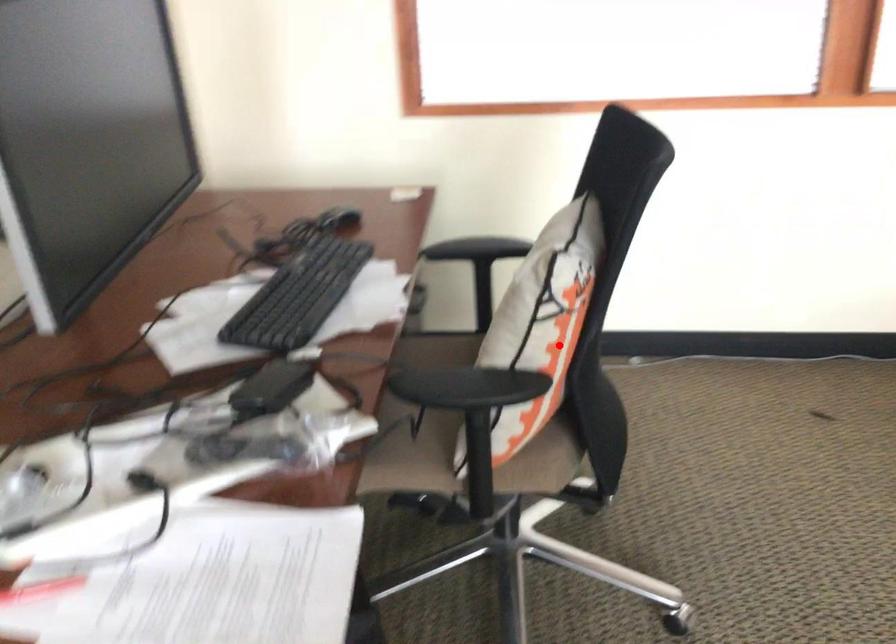
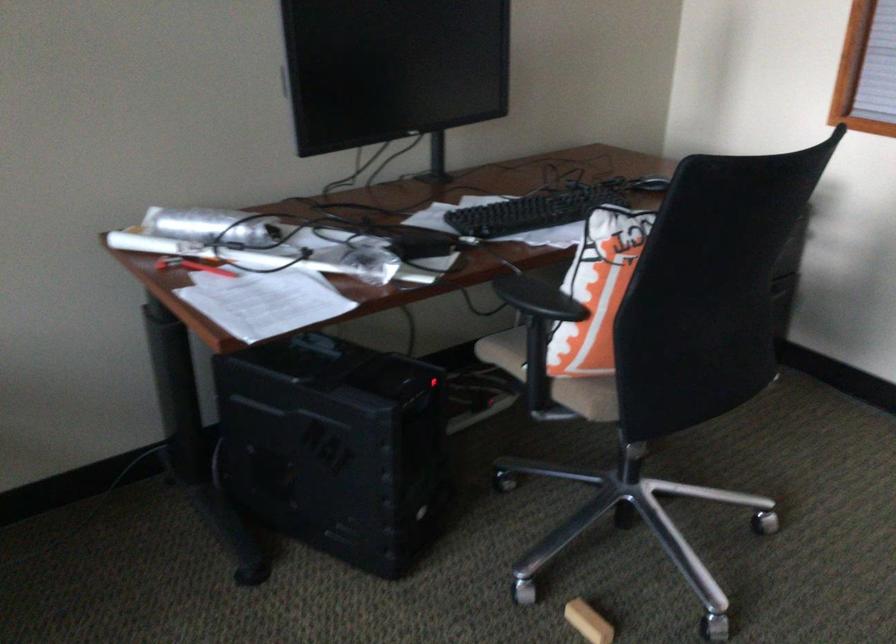
Locate, in the second image, the point that corresponds to the highlighted location in the first image.

(597, 290)